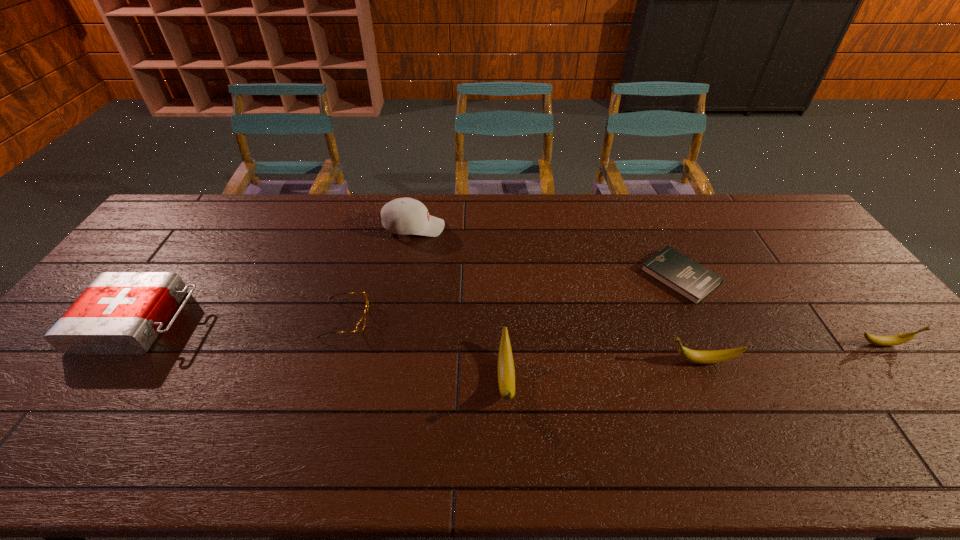
This screenshot has width=960, height=540. Identify the location of free point between the second shortest banana and the leftmost banana. (604, 370).

Locate an element on the screen. free space between the leftmost banana and the leftmost object is located at coordinates (323, 350).

Locate an element on the screen. Image resolution: width=960 pixels, height=540 pixels. empty space that is in between the leftmost object and the tallest banana is located at coordinates (323, 350).

Where is `empty space that is in between the fourth object from right to left and the farthest object`? empty space that is in between the fourth object from right to left and the farthest object is located at coordinates (460, 303).

This screenshot has height=540, width=960. I want to click on vacant area that lies between the leftmost object and the leftmost banana, so (323, 350).

You are a GUI agent. You are given a task and a screenshot of the screen. Output one action in this format:
    pyautogui.click(x=<x>, y=<y>)
    Task: Click on the free spot between the rightmost banana and the second shortest banana
    The height and width of the screenshot is (540, 960).
    Given the screenshot: What is the action you would take?
    pyautogui.click(x=792, y=353)

Identify which object is located as the second nearest to the rightmost object. Please provide its 2D coordinates. Your answer should be formatted as a tuple, i.e. [(x, y)], where the tuple contains the x and y coordinates of a point satisfying the conditions above.

[(695, 356)]

Where is `object that stands as the sixth closest to the baseball cap`? object that stands as the sixth closest to the baseball cap is located at coordinates pos(893,340).

I want to click on banana that stands as the second closest to the baseball cap, so click(695, 356).

Find the location of a particular element. Image resolution: width=960 pixels, height=540 pixels. banana that is the second closest to the second shortest banana is located at coordinates (506, 374).